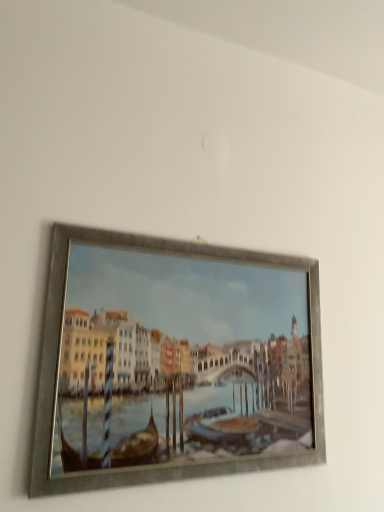
What is the approximate height of metallic silver picture frame at center?

22.77 inches.

Find the location of a particular element. The image size is (384, 512). metallic silver picture frame at center is located at coordinates 174,362.

Describe the element at coordinates (174, 362) in the screenshot. I see `metallic silver picture frame at center` at that location.

Locate an element on the screen. The width and height of the screenshot is (384, 512). metallic silver picture frame at center is located at coordinates (174, 362).